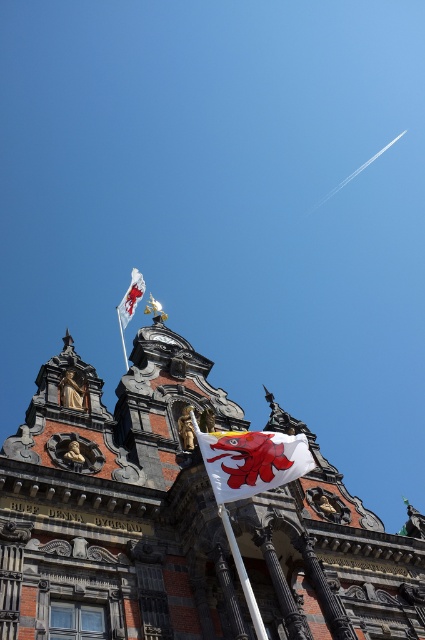
Is white fabric flag at center closer to camera compared to white fabric flag at upper center?

Yes, it is in front of white fabric flag at upper center.

Which of these two, white fabric flag at center or white fabric flag at upper center, stands shorter?

white fabric flag at center is shorter.

Which is in front, point (240, 445) or point (133, 301)?

Point (240, 445)

This screenshot has width=425, height=640. In order to click on white fabric flag at center in this screenshot , I will do `click(251, 460)`.

Can you confirm if dark stone tower at center is positioned above white plastic flag pole at upper center?

Actually, dark stone tower at center is below white plastic flag pole at upper center.

Between dark stone tower at center and white plastic flag pole at upper center, which one appears on the right side from the viewer's perspective?

Positioned to the right is dark stone tower at center.

Who is more forward, (121, 376) or (116, 305)?

Point (116, 305) is more forward.

You are a GUI agent. You are given a task and a screenshot of the screen. Output one action in this format:
    pyautogui.click(x=<x>, y=<y>)
    Task: Click on the dark stone tower at center
    
    Given the screenshot: What is the action you would take?
    pyautogui.click(x=118, y=502)

Which is more to the left, white fabric flag at center or white plastic flag pole at upper center?

white plastic flag pole at upper center is more to the left.

Can you confirm if white fabric flag at center is bigger than white plastic flag pole at upper center?

No.

Locate an element on the screen. The width and height of the screenshot is (425, 640). white fabric flag at center is located at coordinates (251, 460).